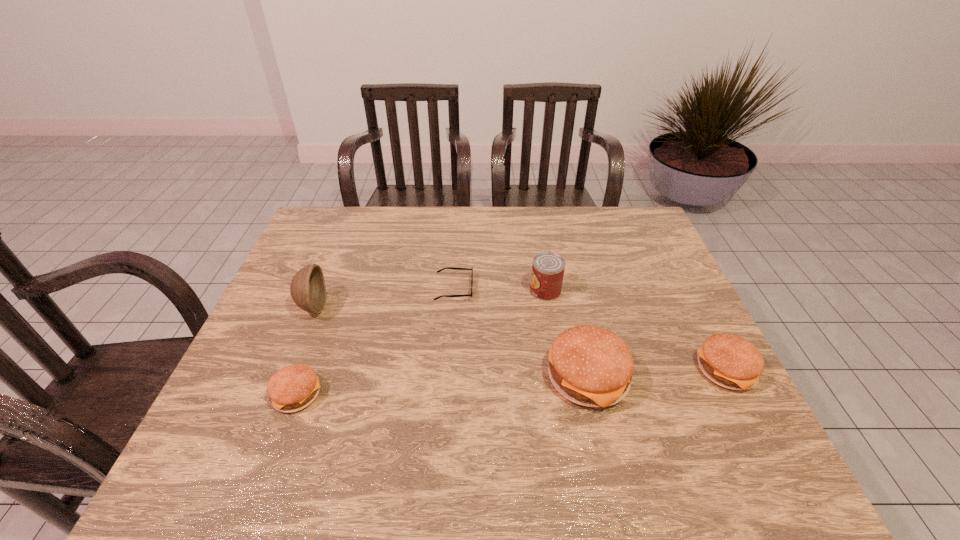
I want to click on free space between the tallest hamburger and the second shortest object, so click(x=443, y=386).

Where is `free space that is in between the shortest object and the tallest hamburger`? The width and height of the screenshot is (960, 540). free space that is in between the shortest object and the tallest hamburger is located at coordinates (520, 333).

This screenshot has height=540, width=960. Find the location of `vacant point located between the rightmost object and the shortest hamburger`. vacant point located between the rightmost object and the shortest hamburger is located at coordinates (512, 382).

Find the location of `vacant space in between the can and the tallest object`. vacant space in between the can and the tallest object is located at coordinates (429, 299).

The height and width of the screenshot is (540, 960). I want to click on empty space that is in between the shortest object and the second hamburger from right to left, so click(520, 333).

Find the location of a particular element. This screenshot has width=960, height=540. object that is the closest to the second hamburger from right to left is located at coordinates (548, 268).

Find the location of a particular element. object that is the fourth nearest to the can is located at coordinates (292, 388).

In order to click on the second closest hamburger to the second shortest object in this screenshot , I will do `click(730, 361)`.

Choose which hamburger is the second nearest neighbor to the second hamburger from right to left. Please provide its 2D coordinates. Your answer should be formatted as a tuple, i.e. [(x, y)], where the tuple contains the x and y coordinates of a point satisfying the conditions above.

[(292, 388)]

Locate an element on the screen. The width and height of the screenshot is (960, 540). vacant space that satisfies the following two spatial constraints: 1. on the front-facing side of the tallest hamburger; 2. on the right side of the shortest object is located at coordinates (448, 378).